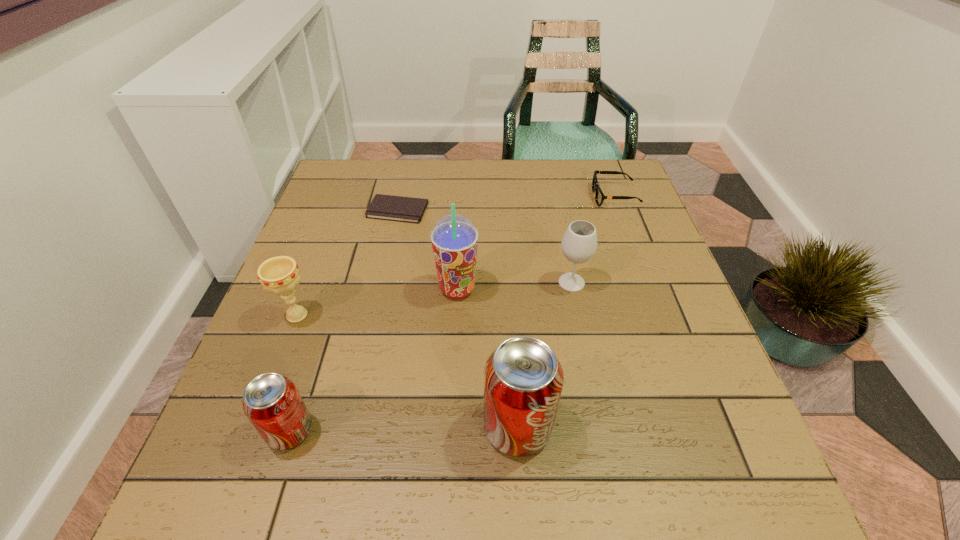
Identify the location of vacant point located between the left soda can and the chalice. (294, 373).

Where is `empty space that is in between the shorter soda can and the chalice`? empty space that is in between the shorter soda can and the chalice is located at coordinates (294, 373).

Locate an element on the screen. This screenshot has height=540, width=960. empty space between the sixth object from left to right and the checkbook is located at coordinates (485, 246).

In order to click on the sixth closest object to the chalice in this screenshot , I will do `click(599, 196)`.

Find the location of a particular element. The width and height of the screenshot is (960, 540). object that is the fifth closest to the shortest object is located at coordinates (523, 379).

The height and width of the screenshot is (540, 960). What are the coordinates of `free location that satisfies the following two spatial constraints: 1. on the front side of the shorter soda can; 2. on the right side of the chalice` in the screenshot? It's located at (253, 430).

The height and width of the screenshot is (540, 960). Find the location of `vacant space that satisfies the following two spatial constraints: 1. on the front side of the shortest object; 2. on the left side of the third object from right to left`. vacant space that satisfies the following two spatial constraints: 1. on the front side of the shortest object; 2. on the left side of the third object from right to left is located at coordinates (350, 427).